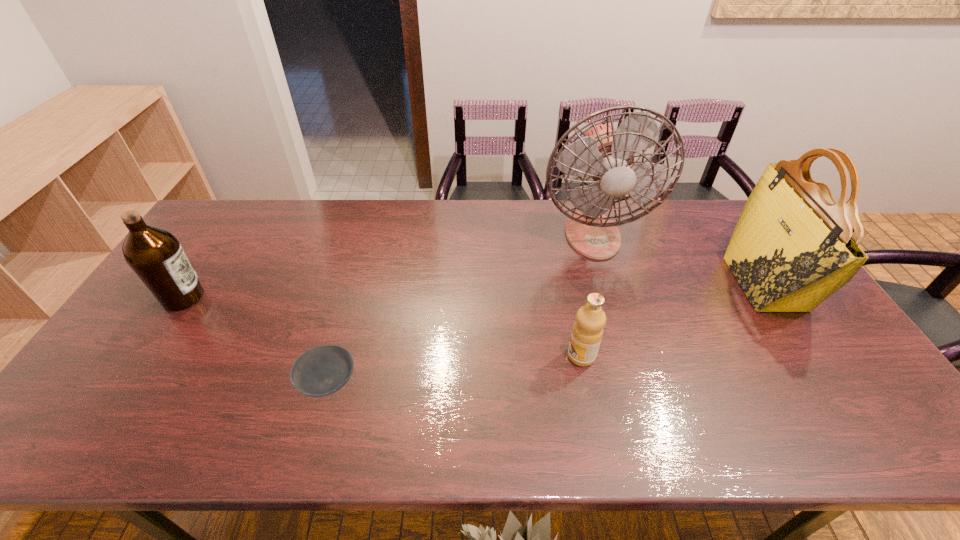
Identify the location of vacant space that satisfies the following two spatial constraints: 1. in front of the fan to direct airflow; 2. on the label of the third shortest object. The image size is (960, 540). [x=611, y=298].

This screenshot has width=960, height=540. Find the location of `vacant point that satisfies the following two spatial constraints: 1. on the label of the shorter olive oil; 2. on the front side of the bowl`. vacant point that satisfies the following two spatial constraints: 1. on the label of the shorter olive oil; 2. on the front side of the bowl is located at coordinates (587, 383).

At what (x,y) coordinates should I click in order to perform the action: click on vacant area in the image that satisfies the following two spatial constraints: 1. in front of the fan to direct airflow; 2. on the label of the farther olive oil. Please return your answer as a coordinate pair (x, y). Looking at the image, I should click on (611, 298).

This screenshot has height=540, width=960. Find the location of `vacant area that satisfies the following two spatial constraints: 1. in front of the fan to direct airflow; 2. on the label of the nearer olive oil`. vacant area that satisfies the following two spatial constraints: 1. in front of the fan to direct airflow; 2. on the label of the nearer olive oil is located at coordinates (627, 356).